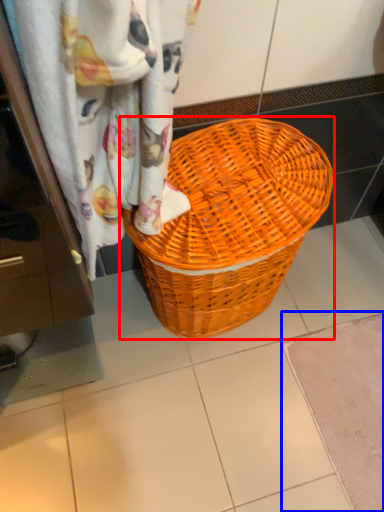
Question: Which point is closer to the camera, picnic basket (highlighted by a red box) or bath mat (highlighted by a blue box)?

Choices:
 (A) picnic basket
 (B) bath mat

Answer: (A)